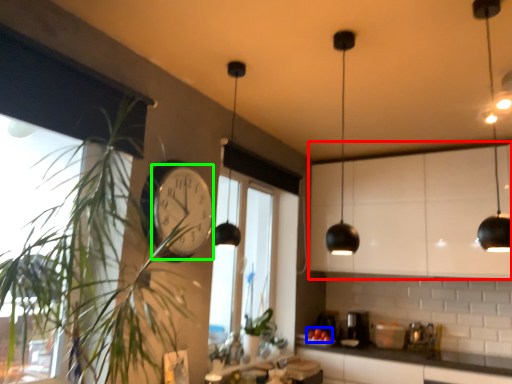
Question: Based on their relative distances, which object is nearer to cabinetry (highlighted by a red box)? Choose from fruit (highlighted by a blue box) and clock (highlighted by a green box).

Choices:
 (A) fruit
 (B) clock

Answer: (A)